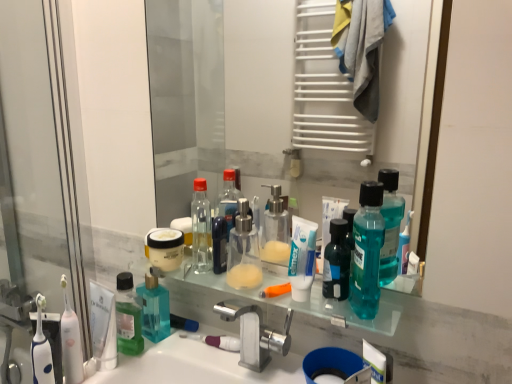
Identify the location of blank space above white glossy sink at lower center (from a real-world perspective). (218, 360).